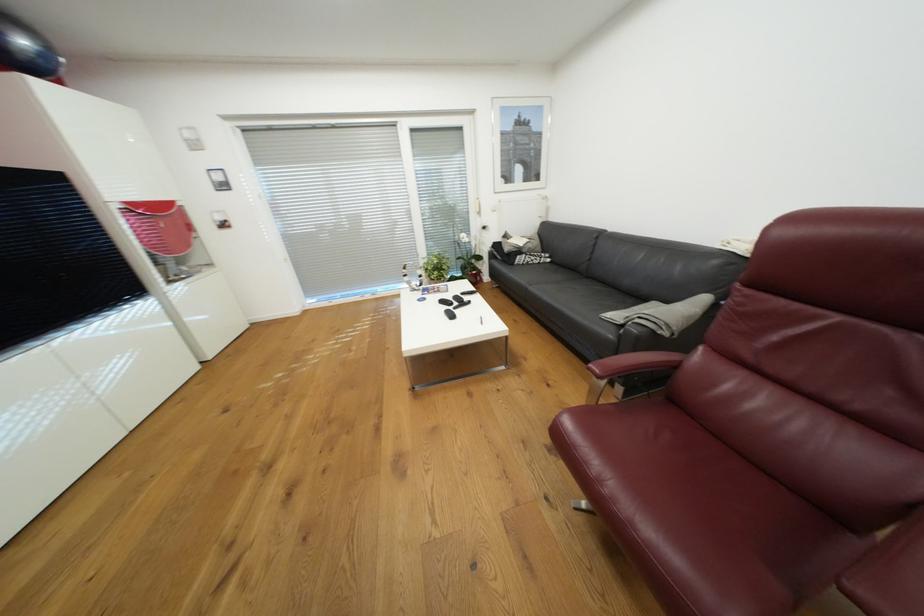
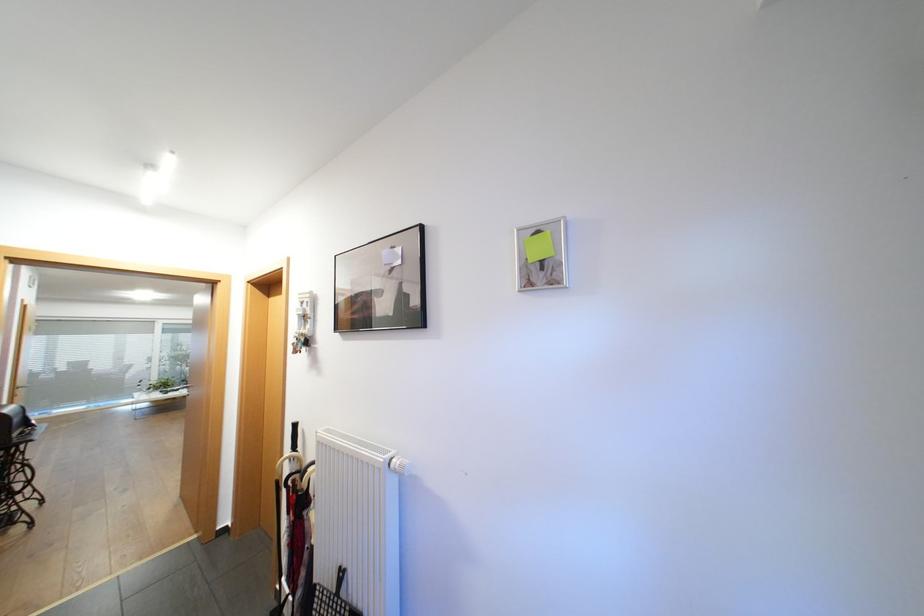
Question: I am providing you with two images of the same scene from different viewpoints. Please identify which objects are invisible in image2.

Choices:
 (A) black umbrella handle
 (B) set of keys
 (C) barbell on rack
 (D) patterned sofa cushion

Answer: (D)